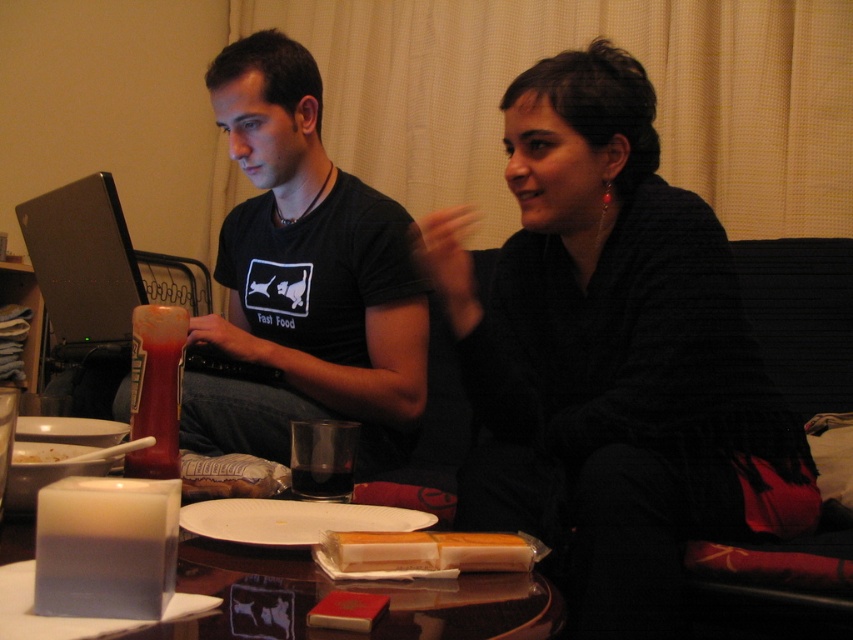
You are a delivery person who needs to place a small package on the table. The silver metallic laptop at left is in the way. Can you slide the package under the laptop to the white paper plate at lower center?

The silver metallic laptop at left is further to the viewer than the white paper plate at lower center, so sliding the package under the laptop would place it closer to the white paper plate at lower center. Yes, you can slide the package under the laptop to the white paper plate at lower center.

You are a guest at a dinner party and notice the translucent glass cup at center and the white paper plate at lower center on the table. Which item has a smaller width?

The translucent glass cup at center has a smaller width than the white paper plate at lower center.